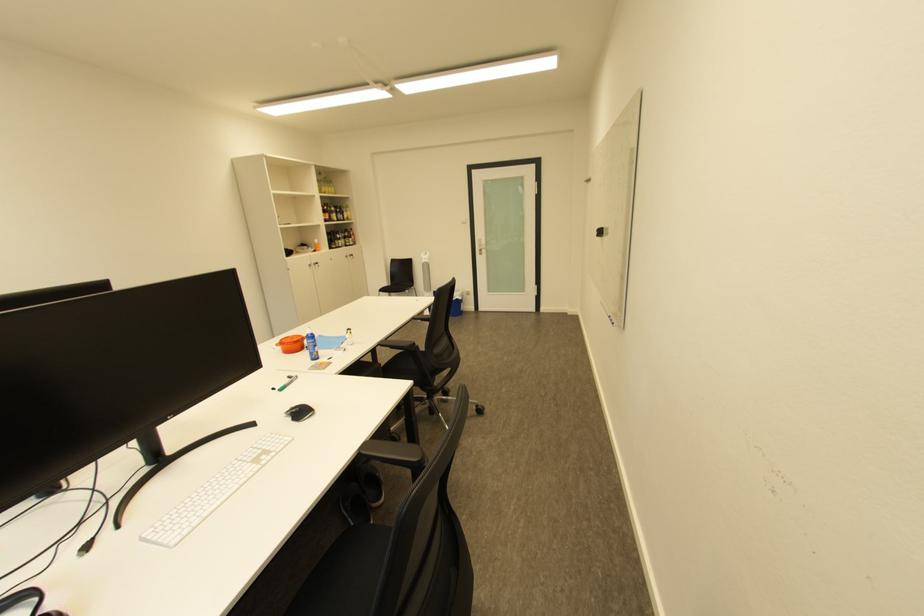
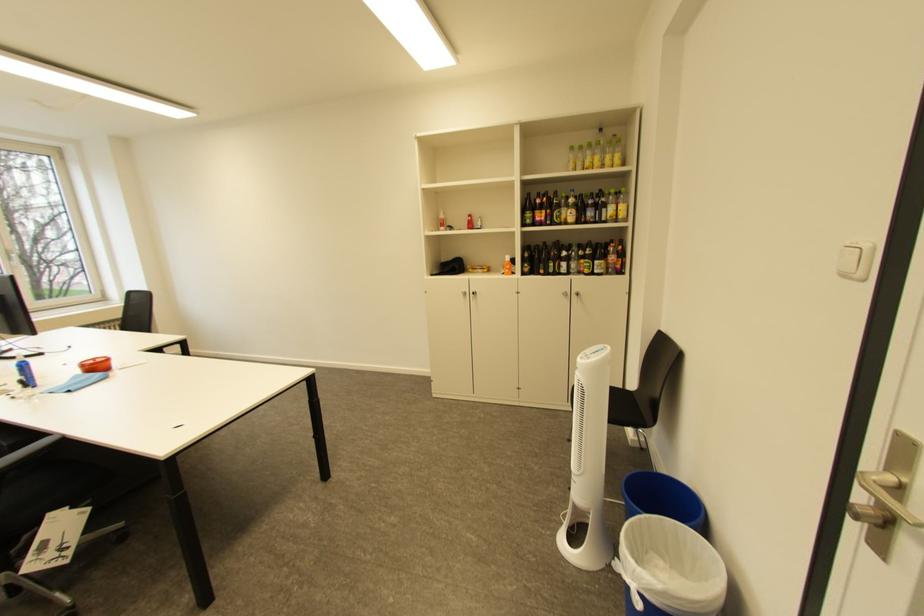
Locate, in the second image, the point that corresponds to [351,214] in the first image.

(610, 208)